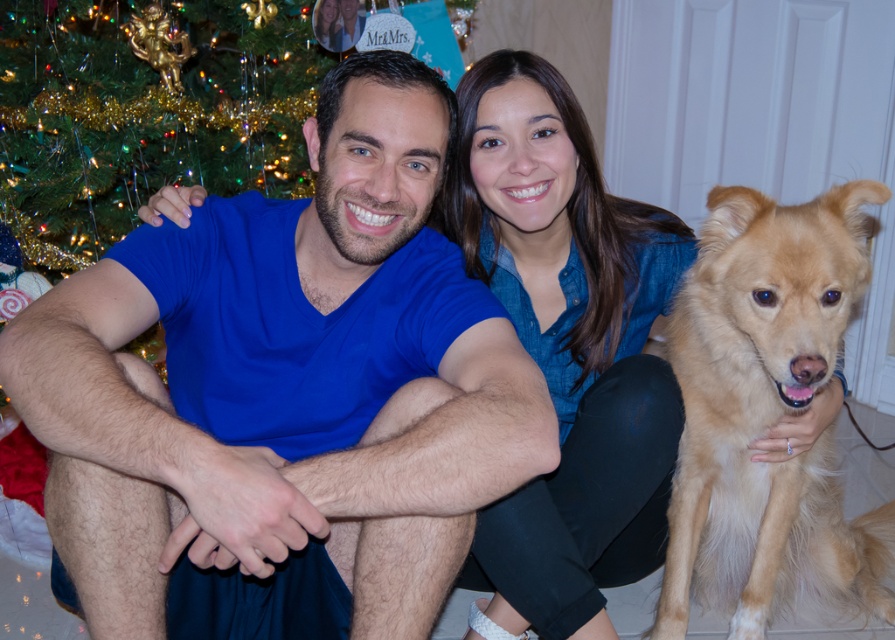
Which is below, denim shirt at center or golden fur dog at right?

golden fur dog at right is below.

Which is above, denim shirt at center or golden fur dog at right?

denim shirt at center is above.

Does point (533, 88) come closer to viewer compared to point (763, 273)?

No, it is behind (763, 273).

The height and width of the screenshot is (640, 895). What are the coordinates of `denim shirt at center` in the screenshot? It's located at (567, 346).

Is point (543, 433) farther from camera compared to point (680, 444)?

That is False.

Which is above, blue matte shirt at center or golden fur dog at right?

blue matte shirt at center is above.

Between point (351, 449) and point (830, 362), which one is positioned behind?

The point (830, 362) is more distant.

The height and width of the screenshot is (640, 895). In order to click on blue matte shirt at center in this screenshot , I will do click(x=282, y=394).

The image size is (895, 640). Find the location of `blue matte shirt at center`. blue matte shirt at center is located at coordinates (282, 394).

Who is more distant from viewer, (267, 227) or (561, 276)?

The point (561, 276) is more distant.

Locate an element on the screen. blue matte shirt at center is located at coordinates (282, 394).